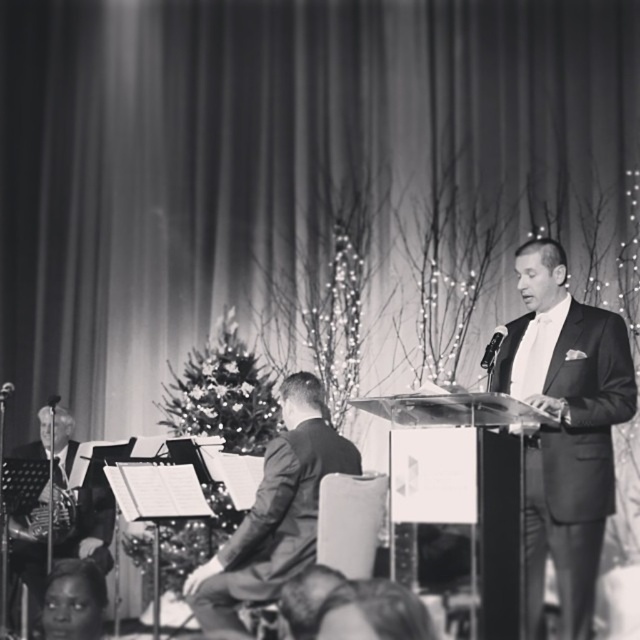
Question: Does smooth black suit at right have a smaller size compared to metallic silver microphone at left?

Choices:
 (A) yes
 (B) no

Answer: (B)

Question: Is smooth black suit at right smaller than metallic silver microphone at left?

Choices:
 (A) no
 (B) yes

Answer: (A)

Question: Which object is farther from the camera taking this photo?

Choices:
 (A) metallic silver microphone at left
 (B) smooth black suit at right
 (C) smooth skin face at lower left

Answer: (A)

Question: Which point is closer to the camera?

Choices:
 (A) metallic silver microphone at left
 (B) smooth black suit at right
 (C) smooth gray suit at center

Answer: (B)

Question: Which object is positioned closest to the smooth gray suit at center?

Choices:
 (A) smooth skin face at lower left
 (B) shiny silver saxophone at left

Answer: (A)

Question: Can you confirm if smooth gray suit at center is positioned to the right of shiny silver saxophone at left?

Choices:
 (A) yes
 (B) no

Answer: (A)